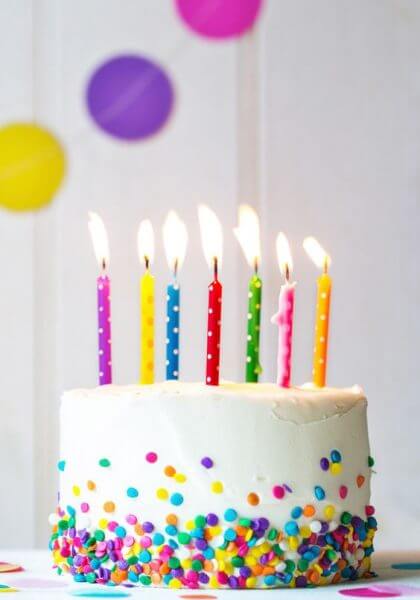
At what (x,y) coordinates should I click in order to perform the action: click on candle wicks. Please return your answer as a coordinate pair (x, y). This screenshot has height=600, width=420. Looking at the image, I should click on (104, 266), (147, 262), (176, 268), (216, 266), (257, 268), (288, 273), (327, 266).